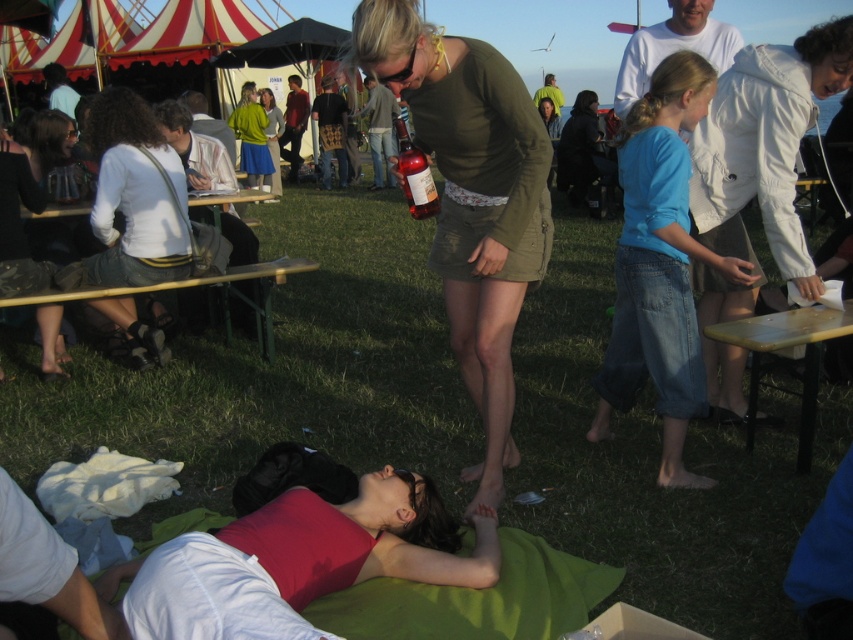
Question: Which object appears closest to the camera in this image?

Choices:
 (A) matte green dress at center
 (B) dark brown leather jacket at upper center

Answer: (A)

Question: Is dark brown leather jacket at upper center to the right of green skirt at center from the viewer's perspective?

Choices:
 (A) no
 (B) yes

Answer: (B)

Question: Does white cotton shirt at upper right have a smaller size compared to white shirt at upper left?

Choices:
 (A) no
 (B) yes

Answer: (B)

Question: Among these objects, which one is nearest to the camera?

Choices:
 (A) blue denim jeans at center
 (B) white cotton shirt at upper right
 (C) matte white shirt at left
 (D) white matte shirt at left

Answer: (A)

Question: Is green skirt at center bigger than green fabric jacket at upper center?

Choices:
 (A) no
 (B) yes

Answer: (A)

Question: Which of these objects is positioned closest to the white matte jacket at upper right?

Choices:
 (A) light brown leather jacket at upper center
 (B) matte green dress at center

Answer: (B)